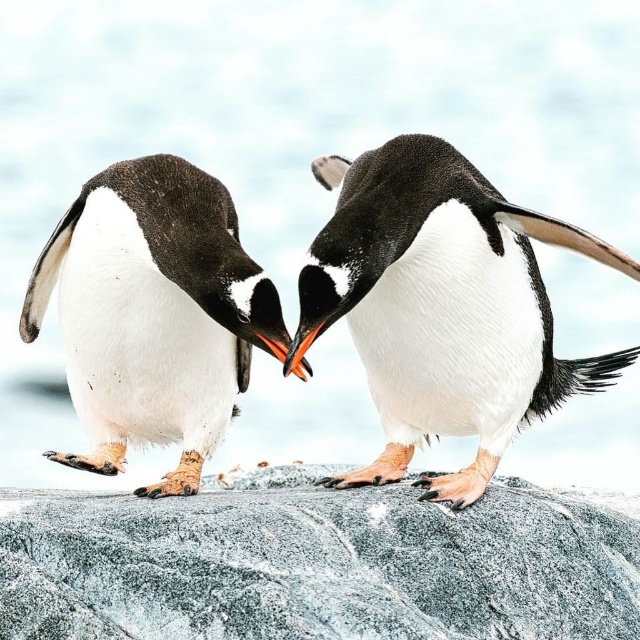
Question: Which point is closer to the camera?

Choices:
 (A) (417, 596)
 (B) (492, 456)

Answer: (A)

Question: Which point is closer to the camera?

Choices:
 (A) (352, 547)
 (B) (300, 312)

Answer: (A)

Question: Which point is closer to the camera?

Choices:
 (A) white matte penguin at left
 (B) gray granite rock at center

Answer: (B)

Question: Is white fluffy penguin at center to the left of white matte penguin at left from the viewer's perspective?

Choices:
 (A) yes
 (B) no

Answer: (B)

Question: Is white fluffy penguin at center to the right of white matte penguin at left from the viewer's perspective?

Choices:
 (A) yes
 (B) no

Answer: (A)

Question: Observing the image, what is the correct spatial positioning of gray granite rock at center in reference to white matte penguin at left?

Choices:
 (A) right
 (B) left

Answer: (A)